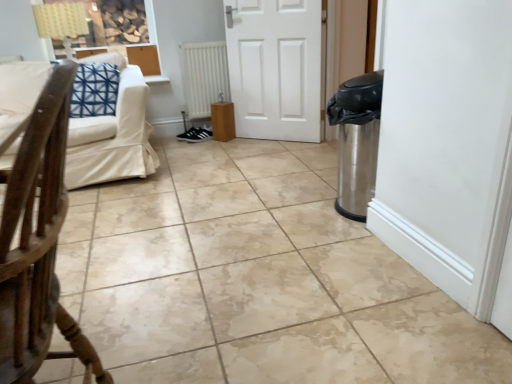
Image resolution: width=512 pixels, height=384 pixels. I want to click on vacant space behind wooden chair at left, so click(147, 330).